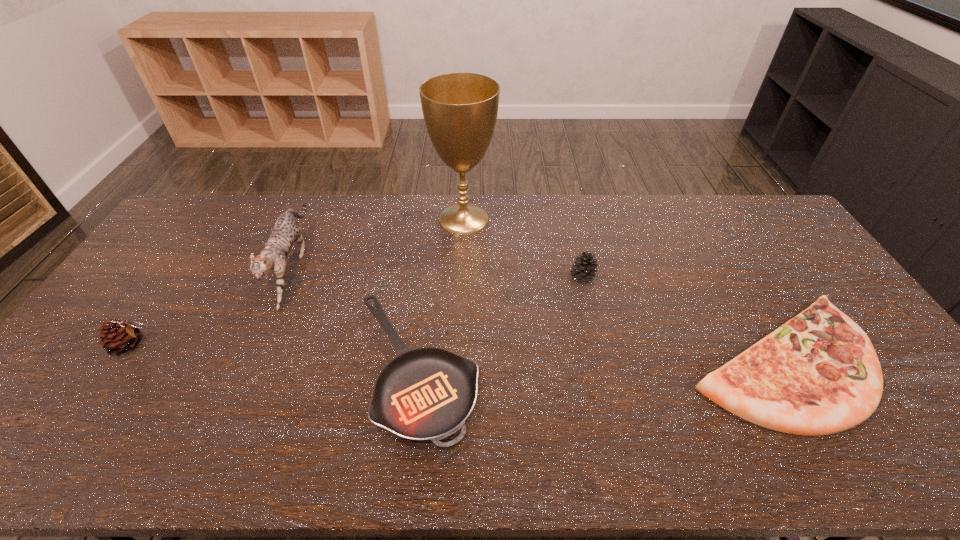
Where is `vacant area that satisfies the following two spatial constraints: 1. on the face of the cat; 2. on the right side of the rightmost object`? The width and height of the screenshot is (960, 540). vacant area that satisfies the following two spatial constraints: 1. on the face of the cat; 2. on the right side of the rightmost object is located at coordinates point(252,361).

Where is `vacant region that satisfies the following two spatial constraints: 1. on the face of the cat; 2. with a leaf charm attached to the nearer pinecone`? The image size is (960, 540). vacant region that satisfies the following two spatial constraints: 1. on the face of the cat; 2. with a leaf charm attached to the nearer pinecone is located at coordinates (258, 345).

Locate an element on the screen. This screenshot has height=540, width=960. blank space that satisfies the following two spatial constraints: 1. on the face of the right pinecone; 2. on the left side of the cat is located at coordinates (287, 278).

This screenshot has width=960, height=540. What are the coordinates of `free location that satisfies the following two spatial constraints: 1. on the front side of the trophy cup; 2. with a leaf charm attached to the nearer pinecone` in the screenshot? It's located at (459, 345).

This screenshot has width=960, height=540. I want to click on free spot that satisfies the following two spatial constraints: 1. on the face of the fifth shortest object; 2. on the right side of the pizza, so click(x=252, y=361).